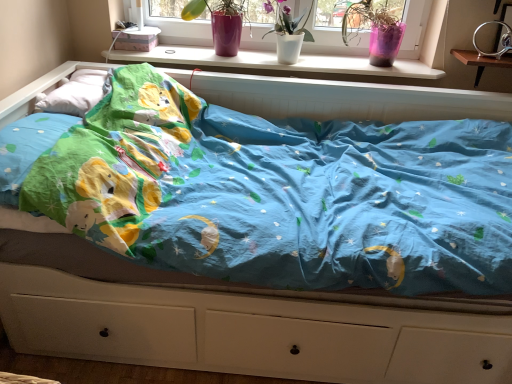
Question: Can you confirm if matte pink vase at upper center, arranged as the first floral arrangement when viewed from the left, is thinner than wooden changing table at upper right?

Choices:
 (A) no
 (B) yes

Answer: (A)

Question: Can you confirm if matte pink vase at upper center, the third floral arrangement from the right, is shorter than wooden changing table at upper right?

Choices:
 (A) no
 (B) yes

Answer: (A)

Question: Is matte pink vase at upper center, the third floral arrangement from the right, at the left side of wooden changing table at upper right?

Choices:
 (A) no
 (B) yes

Answer: (B)

Question: From a real-world perspective, is matte pink vase at upper center, the third floral arrangement from the right, physically above wooden changing table at upper right?

Choices:
 (A) no
 (B) yes

Answer: (B)

Question: From the image's perspective, is matte pink vase at upper center, arranged as the first floral arrangement when viewed from the left, on wooden changing table at upper right?

Choices:
 (A) yes
 (B) no

Answer: (A)

Question: Is pink plastic pot at upper right, which is the first floral arrangement from right to left, wider or thinner than white soft pillow at upper left?

Choices:
 (A) wide
 (B) thin

Answer: (B)

Question: In terms of size, does pink plastic pot at upper right, marked as the 3th floral arrangement in a left-to-right arrangement, appear bigger or smaller than white soft pillow at upper left?

Choices:
 (A) small
 (B) big

Answer: (B)

Question: Considering the positions of point (371, 34) and point (45, 107), is point (371, 34) closer or farther from the camera than point (45, 107)?

Choices:
 (A) farther
 (B) closer

Answer: (A)

Question: From a real-world perspective, is pink plastic pot at upper right, marked as the 3th floral arrangement in a left-to-right arrangement, positioned above or below white soft pillow at upper left?

Choices:
 (A) below
 (B) above

Answer: (B)

Question: Considering the relative positions of matte pink vase at upper center, arranged as the first floral arrangement when viewed from the left, and white matte vase at upper center, which is counted as the 2th floral arrangement, starting from the right, in the image provided, is matte pink vase at upper center, arranged as the first floral arrangement when viewed from the left, to the left or to the right of white matte vase at upper center, which is counted as the 2th floral arrangement, starting from the right,?

Choices:
 (A) left
 (B) right

Answer: (A)

Question: Considering the positions of matte pink vase at upper center, the third floral arrangement from the right, and white matte vase at upper center, arranged as the 2th floral arrangement when viewed from the left, in the image, is matte pink vase at upper center, the third floral arrangement from the right, wider or thinner than white matte vase at upper center, arranged as the 2th floral arrangement when viewed from the left,?

Choices:
 (A) thin
 (B) wide

Answer: (B)

Question: Is point (236, 51) closer or farther from the camera than point (266, 6)?

Choices:
 (A) farther
 (B) closer

Answer: (B)

Question: From their relative heights in the image, would you say matte pink vase at upper center, the third floral arrangement from the right, is taller or shorter than white matte vase at upper center, which is counted as the 2th floral arrangement, starting from the right?

Choices:
 (A) tall
 (B) short

Answer: (B)

Question: Is wooden changing table at upper right taller or shorter than white plastic window sill at upper center?

Choices:
 (A) short
 (B) tall

Answer: (B)

Question: From the image's perspective, is wooden changing table at upper right above or below white plastic window sill at upper center?

Choices:
 (A) above
 (B) below

Answer: (B)